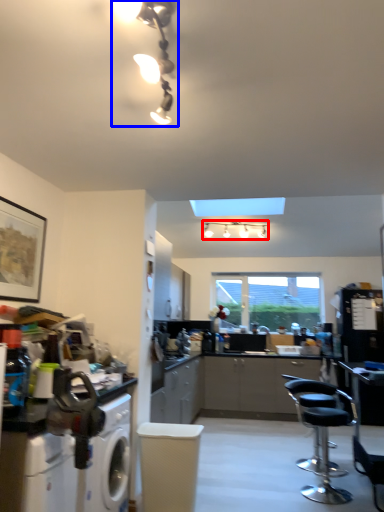
Question: Which object is further to the camera taking this photo, lamp (highlighted by a red box) or light fixture (highlighted by a blue box)?

Choices:
 (A) lamp
 (B) light fixture

Answer: (A)